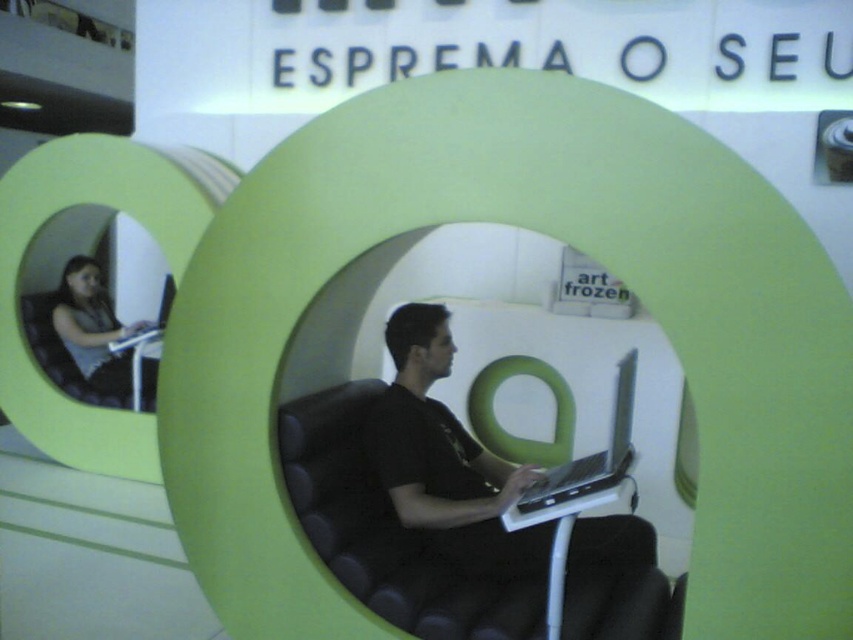
You are organizing a tech event and need to place two laptops on a table. The table has limited space. You have the matte black laptop at left and the silver metallic laptop at center. Which laptop requires more space horizontally to place on the table?

The matte black laptop at left requires more horizontal space because its width is larger than the silver metallic laptop at center.